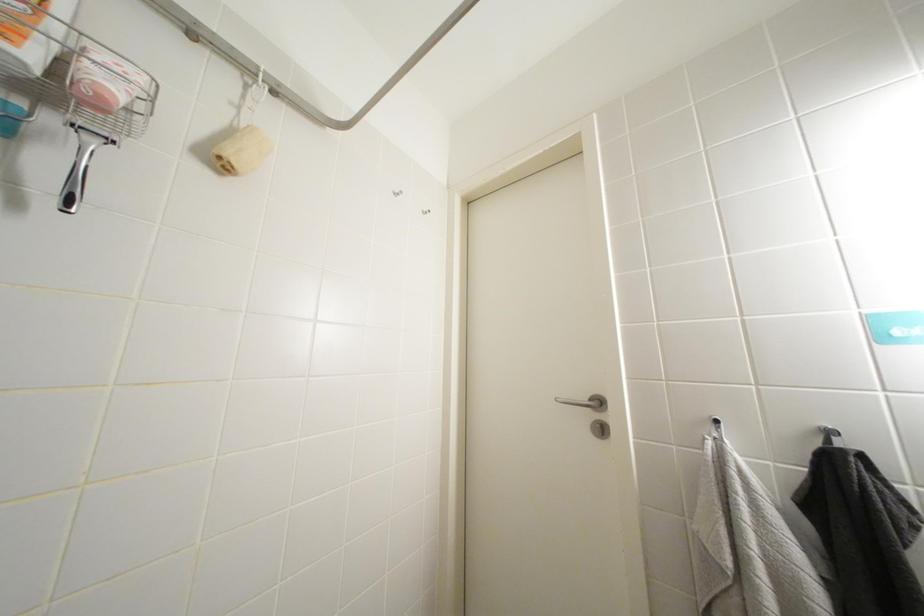
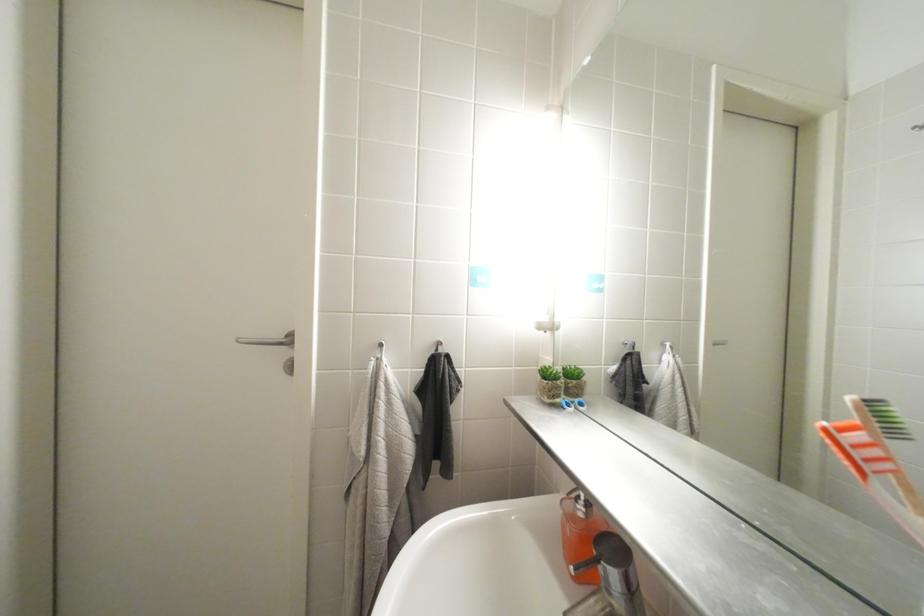
Question: The camera is either moving clockwise (left) or counter-clockwise (right) around the object. The first image is from the beginning of the video and the second image is from the end. Is the camera moving left or right when shooting the video?

Choices:
 (A) Left
 (B) Right

Answer: (A)